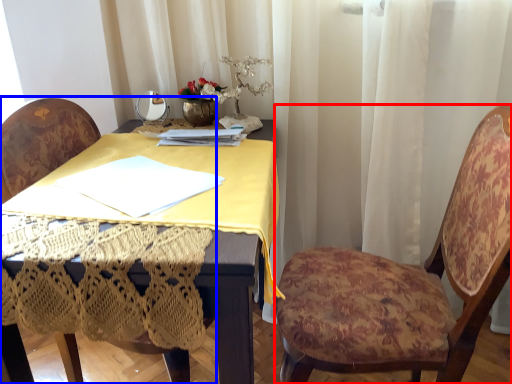
Question: Which of the following is the closest to the observer, chair (highlighted by a red box) or chair (highlighted by a blue box)?

Choices:
 (A) chair
 (B) chair

Answer: (A)